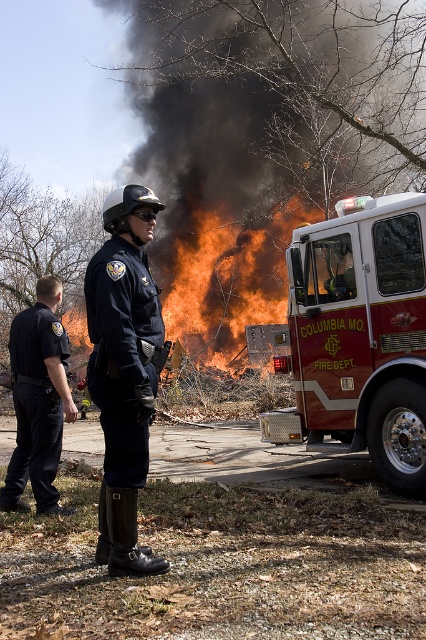
Which is more to the left, matte black uniform at center or flame orange fire at center?

Positioned to the left is matte black uniform at center.

You are a GUI agent. You are given a task and a screenshot of the screen. Output one action in this format:
    pyautogui.click(x=<x>, y=<y>)
    Task: Click on the matte black uniform at center
    The image size is (426, 640).
    Given the screenshot: What is the action you would take?
    pyautogui.click(x=123, y=371)

Can you confirm if red glossy fire truck at right is shorter than matte black uniform at center?

No, red glossy fire truck at right is not shorter than matte black uniform at center.

Can you confirm if red glossy fire truck at right is positioned to the left of matte black uniform at center?

Incorrect, red glossy fire truck at right is not on the left side of matte black uniform at center.

Describe the element at coordinates (359, 337) in the screenshot. I see `red glossy fire truck at right` at that location.

The image size is (426, 640). I want to click on red glossy fire truck at right, so click(359, 337).

Which of these two, black smoke at upper center or matte black uniform at center, stands taller?

black smoke at upper center is taller.

Is black smoke at upper center further to camera compared to matte black uniform at center?

Yes, it is behind matte black uniform at center.

Is point (238, 60) farther from viewer compared to point (123, 365)?

Yes, point (238, 60) is farther from viewer.

You are a GUI agent. You are given a task and a screenshot of the screen. Output one action in this format:
    pyautogui.click(x=<x>, y=<y>)
    Task: Click on the black smoke at upper center
    The height and width of the screenshot is (640, 426).
    Given the screenshot: What is the action you would take?
    click(x=275, y=104)